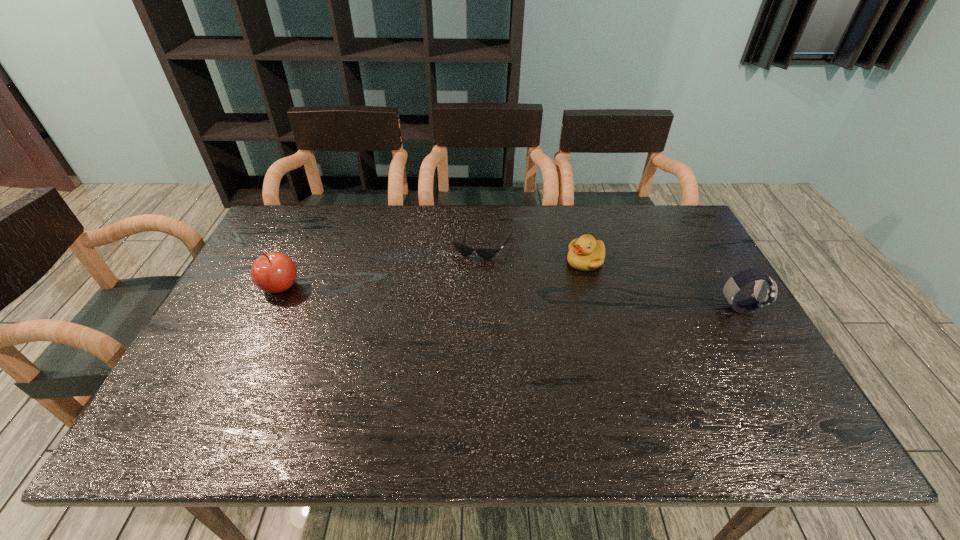
Locate an element on the screen. vacant point located between the shortest object and the second object from right to left is located at coordinates (535, 252).

You are a GUI agent. You are given a task and a screenshot of the screen. Output one action in this format:
    pyautogui.click(x=<x>, y=<y>)
    Task: Click on the empty space between the leftmost object and the second object from left to right
    The image size is (960, 540).
    Given the screenshot: What is the action you would take?
    pyautogui.click(x=382, y=264)

The height and width of the screenshot is (540, 960). I want to click on object that is the third closest to the third object from left to right, so click(273, 272).

Choose which object is the nearest neighbor to the duckling. Please provide its 2D coordinates. Your answer should be formatted as a tuple, i.e. [(x, y)], where the tuple contains the x and y coordinates of a point satisfying the conditions above.

[(486, 253)]

I want to click on free space that satisfies the following two spatial constraints: 1. on the front side of the rightmost object; 2. on the face of the apple, so click(x=270, y=308).

Where is `vacant space that satisfies the following two spatial constraints: 1. on the front side of the watch; 2. on the face of the leftmost object`? vacant space that satisfies the following two spatial constraints: 1. on the front side of the watch; 2. on the face of the leftmost object is located at coordinates (270, 308).

Find the location of a particular element. Image resolution: width=960 pixels, height=540 pixels. vacant space that satisfies the following two spatial constraints: 1. on the front side of the apple; 2. on the face of the rightmost object is located at coordinates [x=270, y=308].

Identify the location of vacant point that satisfies the following two spatial constraints: 1. on the front side of the apple; 2. on the face of the rightmost object. This screenshot has width=960, height=540. (270, 308).